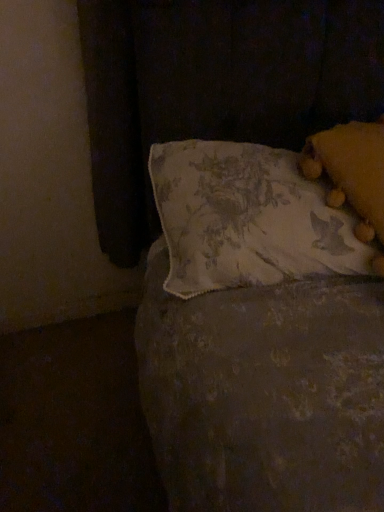
What do you see at coordinates (247, 218) in the screenshot? I see `floral fabric pillow at center` at bounding box center [247, 218].

Measure the distance between point (260, 193) and camera.

36.42 inches.

This screenshot has width=384, height=512. What are the coordinates of `floral fabric pillow at center` in the screenshot? It's located at (247, 218).

Where is `floral fabric pillow at center`? floral fabric pillow at center is located at coordinates (247, 218).